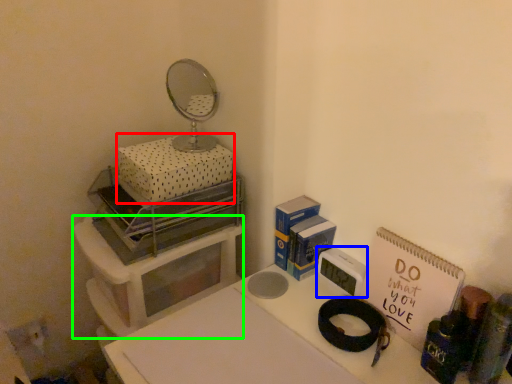
Question: Which object is the farthest from box (highlighted by a red box)? Choose among these: appliance (highlighted by a blue box) or furniture (highlighted by a green box).

Choices:
 (A) appliance
 (B) furniture

Answer: (A)